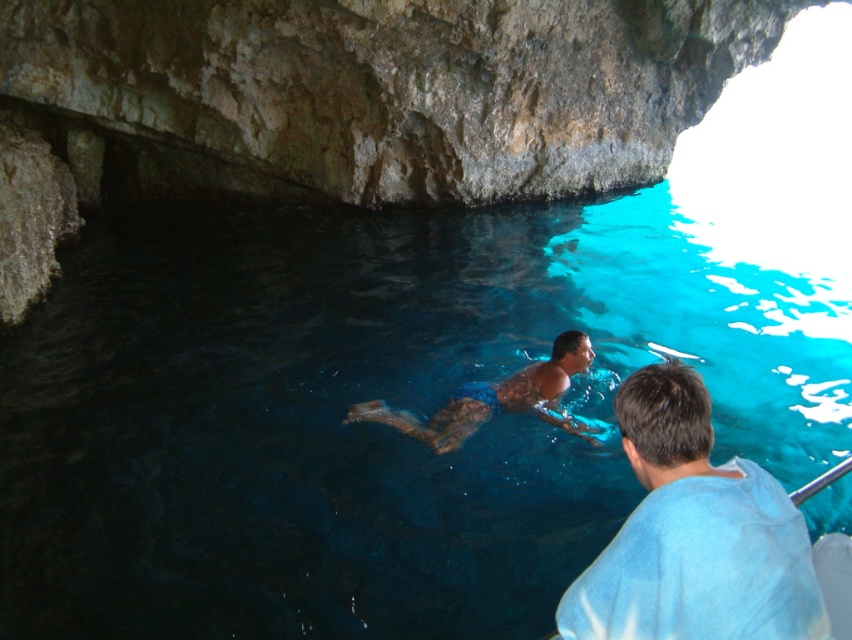
Is clear blue water at center bigger than camouflage swim trunks at center?

Yes.

Does point (32, 593) lie behind point (407, 420)?

No, it is not.

Where is `clear blue water at center`? The width and height of the screenshot is (852, 640). clear blue water at center is located at coordinates (366, 422).

Identify the location of clear blue water at center. (366, 422).

Is point (803, 620) farther from viewer compared to point (476, 392)?

That is False.

Between smooth skin man at center and camouflage swim trunks at center, which one has more height?

camouflage swim trunks at center

What are the coordinates of `smooth skin man at center` in the screenshot? It's located at (694, 534).

What do you see at coordinates (366, 422) in the screenshot? I see `clear blue water at center` at bounding box center [366, 422].

Is point (337, 557) more distant than point (678, 401)?

Yes, point (337, 557) is farther from viewer.

Where is `clear blue water at center`? clear blue water at center is located at coordinates (366, 422).